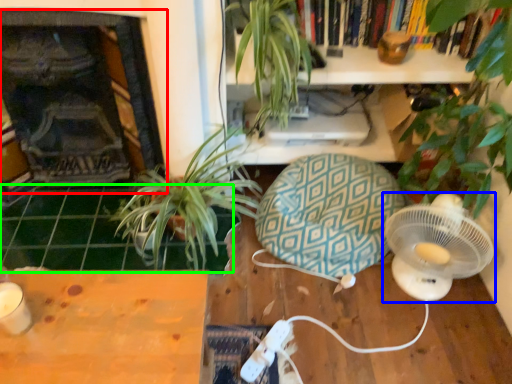
Question: Which object is positioned closest to fireplace (highlighted by a red box)? Select from mechanical fan (highlighted by a blue box) and tile (highlighted by a green box).

Choices:
 (A) mechanical fan
 (B) tile

Answer: (B)